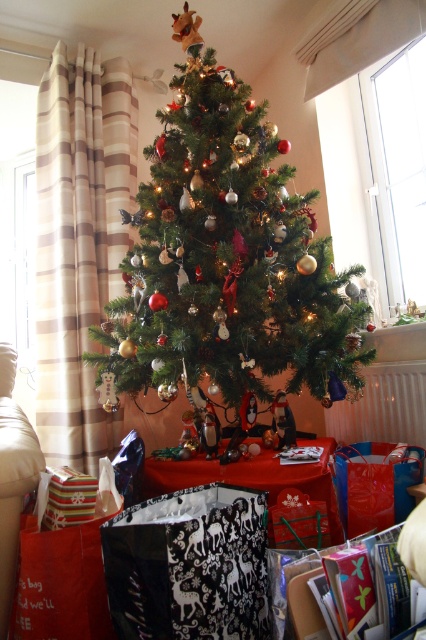
The width and height of the screenshot is (426, 640). I want to click on green natural christmas tree at center, so coord(226,257).

Is green natural christmas tree at center to the left of striped paper gift at lower left from the viewer's perspective?

Incorrect, green natural christmas tree at center is not on the left side of striped paper gift at lower left.

Who is more forward, (167, 172) or (60, 483)?

Point (60, 483)

Identify the location of green natural christmas tree at center. (226, 257).